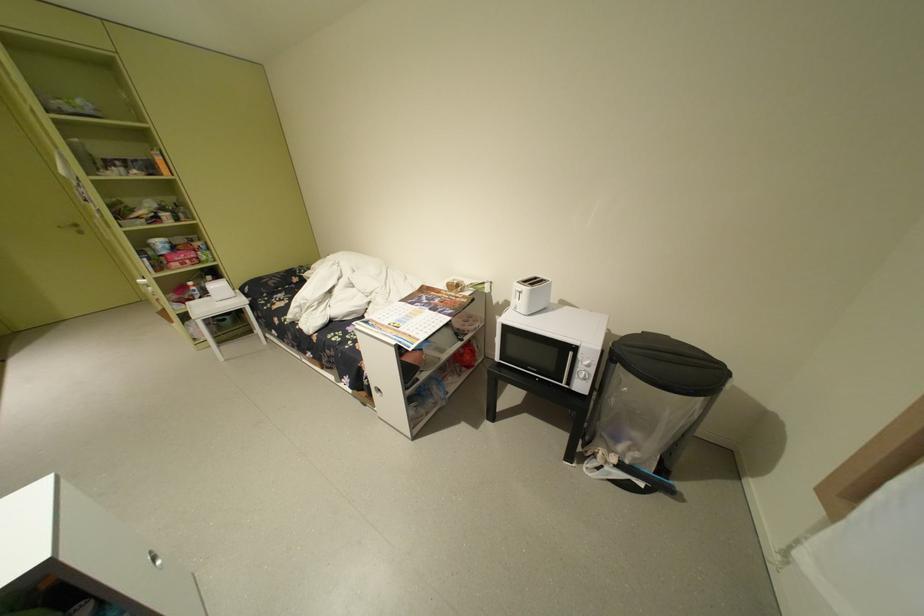
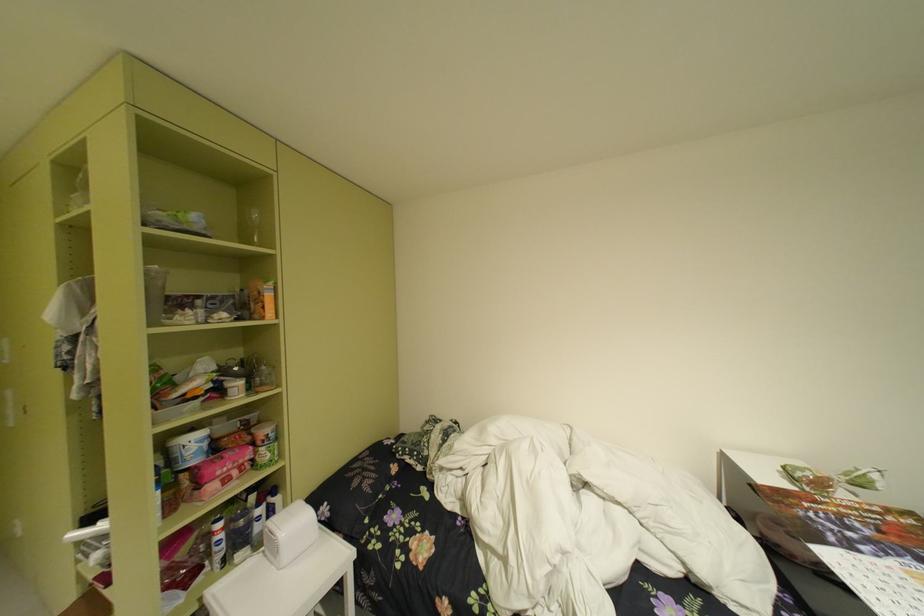
What movement of the cameraman would produce the second image?

The cameraman walked toward left, forward.